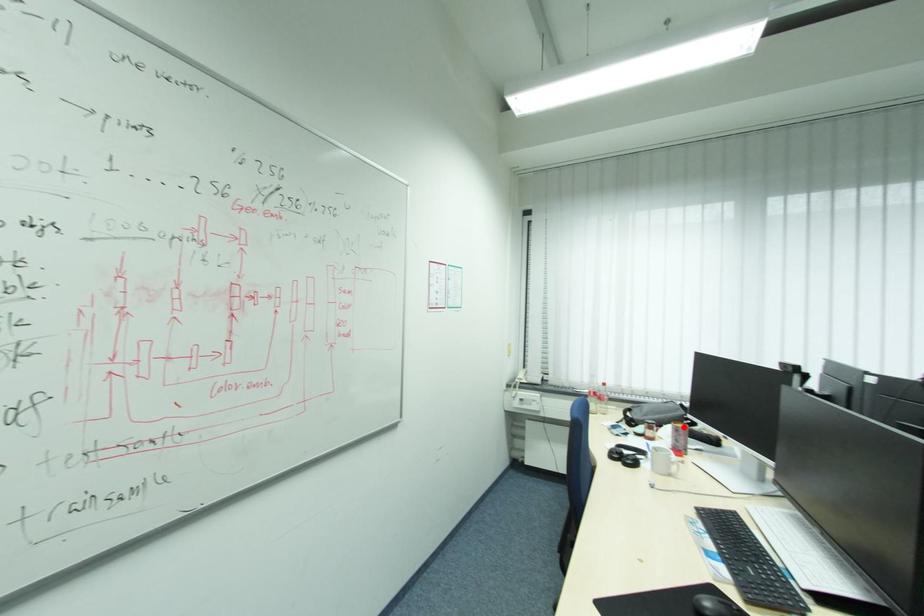
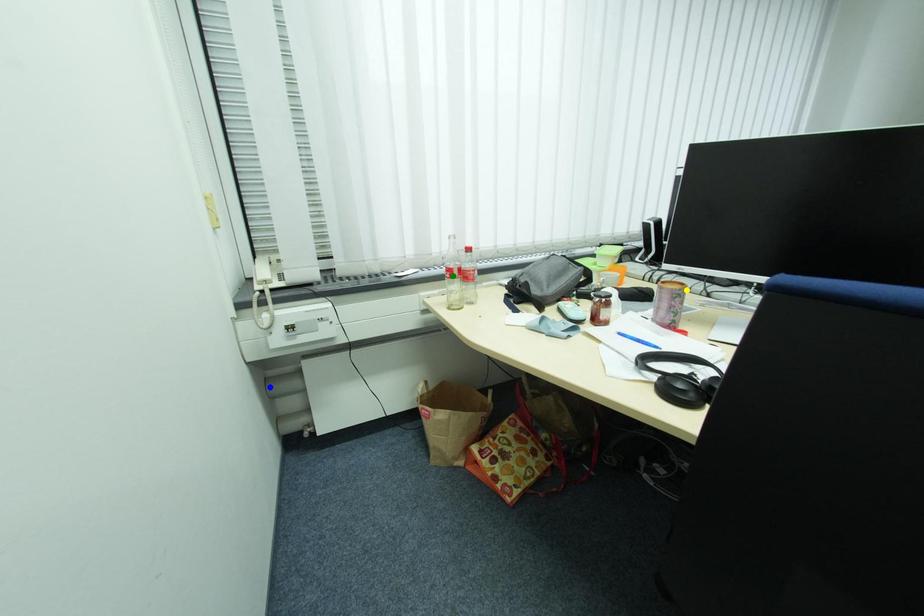
Question: I am providing you with two images of the same scene from different viewpoints. A red point is marked on the first image. You are given multiple points on the second image. Which point in image 2 is actually the same real-world point as the red point in image 1?

Choices:
 (A) green point
 (B) blue point
 (C) yellow point

Answer: (C)